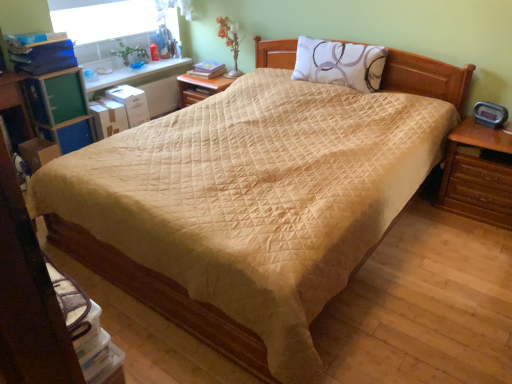
Measure the distance between point (81, 38) and camera.

A distance of 11.76 feet exists between point (81, 38) and camera.

Image resolution: width=512 pixels, height=384 pixels. I want to click on white plastic window screen at upper left, so click(x=106, y=26).

Does matte yellow book at center turn towards white plastic window screen at upper left?

No, matte yellow book at center does not turn towards white plastic window screen at upper left.

Consider the image. Which of these two, matte yellow book at center or white plastic window screen at upper left, stands shorter?

matte yellow book at center.

In the image, is matte yellow book at center on the left side or the right side of white plastic window screen at upper left?

In the image, matte yellow book at center appears on the right side of white plastic window screen at upper left.

Does matte yellow book at center have a smaller size compared to white printed pillow at upper center?

Yes, matte yellow book at center is smaller than white printed pillow at upper center.

Is matte yellow book at center not near white printed pillow at upper center?

Yes, matte yellow book at center is far from white printed pillow at upper center.

From the image's perspective, which is below, matte yellow book at center or white printed pillow at upper center?

white printed pillow at upper center, from the image's perspective.

Which object is more forward, matte yellow book at center or white printed pillow at upper center?

white printed pillow at upper center.

Who is bigger, white plastic window screen at upper left or white printed pillow at upper center?

Bigger between the two is white plastic window screen at upper left.

Which object is thinner, white plastic window screen at upper left or white printed pillow at upper center?

With smaller width is white plastic window screen at upper left.

Could you measure the distance between white plastic window screen at upper left and white printed pillow at upper center?

white plastic window screen at upper left and white printed pillow at upper center are 1.77 meters apart.

Considering the positions of objects white printed pillow at upper center and white plastic window screen at upper left in the image provided, who is more to the right, white printed pillow at upper center or white plastic window screen at upper left?

white printed pillow at upper center is more to the right.

Can you confirm if white printed pillow at upper center is taller than white plastic window screen at upper left?

No, white printed pillow at upper center is not taller than white plastic window screen at upper left.

From the image's perspective, between white printed pillow at upper center and white plastic window screen at upper left, who is located below?

From the image's view, white printed pillow at upper center is below.

Measure the distance between white printed pillow at upper center and white plastic window screen at upper left.

white printed pillow at upper center and white plastic window screen at upper left are 1.77 meters apart from each other.

Based on the photo, can you tell me how much white printed pillow at upper center and matte yellow book at center differ in facing direction?

5.79 degrees.

From the image's perspective, who appears lower, white printed pillow at upper center or matte yellow book at center?

From the image's view, white printed pillow at upper center is below.

Is white printed pillow at upper center wider or thinner than matte yellow book at center?

In the image, white printed pillow at upper center appears to be more narrow than matte yellow book at center.

In the image, is white printed pillow at upper center positioned in front of or behind matte yellow book at center?

white printed pillow at upper center is positioned closer to the viewer than matte yellow book at center.

Is white plastic window screen at upper left turned away from matte yellow book at center?

white plastic window screen at upper left does not have its back to matte yellow book at center.

How many degrees apart are the facing directions of white plastic window screen at upper left and matte yellow book at center?

The facing directions of white plastic window screen at upper left and matte yellow book at center are 84.3 degrees apart.

Measure the distance from white plastic window screen at upper left to matte yellow book at center.

white plastic window screen at upper left is 31.13 inches from matte yellow book at center.

From a real-world perspective, does white plastic window screen at upper left sit lower than matte yellow book at center?

No, from a real-world perspective, white plastic window screen at upper left is not beneath matte yellow book at center.

The width and height of the screenshot is (512, 384). What are the coordinates of `book behind the white plastic window screen at upper left` in the screenshot? It's located at (207, 69).

This screenshot has width=512, height=384. Identify the location of book directly beneath the white printed pillow at upper center (from a real-world perspective). (207, 69).

When comparing their distances from white printed pillow at upper center, does matte yellow book at center or white plastic window screen at upper left seem further?

Among the two, white plastic window screen at upper left is located further to white printed pillow at upper center.

Which object lies further to the anchor point white plastic window screen at upper left, matte yellow book at center or white printed pillow at upper center?

Among the two, white printed pillow at upper center is located further to white plastic window screen at upper left.

Based on their spatial positions, is white printed pillow at upper center or matte yellow book at center closer to white plastic window screen at upper left?

matte yellow book at center is positioned closer to the anchor white plastic window screen at upper left.

Based on their spatial positions, is white plastic window screen at upper left or matte yellow book at center further from white printed pillow at upper center?

white plastic window screen at upper left.

From the image, which object appears to be nearer to matte yellow book at center, white plastic window screen at upper left or white printed pillow at upper center?

A: white plastic window screen at upper left is closer to matte yellow book at center.

From the image, which object appears to be nearer to matte yellow book at center, white printed pillow at upper center or white plastic window screen at upper left?

white plastic window screen at upper left.

Where is `book between white plastic window screen at upper left and white printed pillow at upper center from left to right`? book between white plastic window screen at upper left and white printed pillow at upper center from left to right is located at coordinates (207, 69).